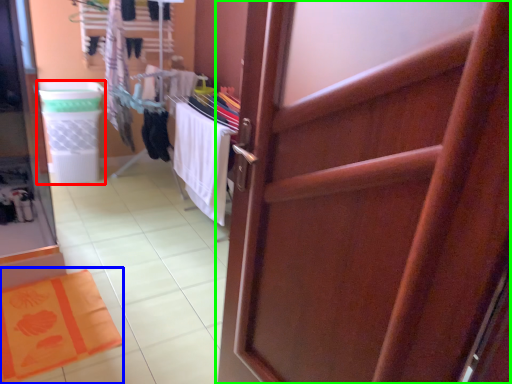
Question: Based on their relative distances, which object is nearer to laundry basket (highlighted by a red box)? Choose from bath mat (highlighted by a blue box) and door (highlighted by a green box).

Choices:
 (A) bath mat
 (B) door

Answer: (A)